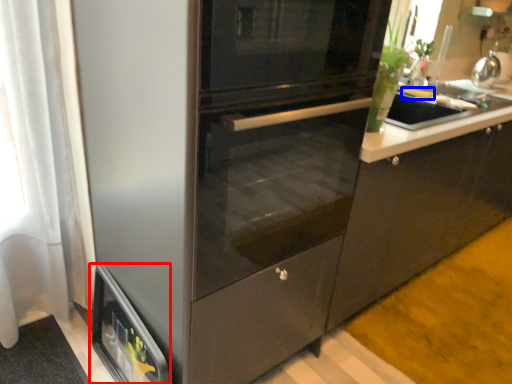
Question: Which object appears closest to the camera in this image, home appliance (highlighted by a red box) or food (highlighted by a blue box)?

Choices:
 (A) home appliance
 (B) food

Answer: (A)